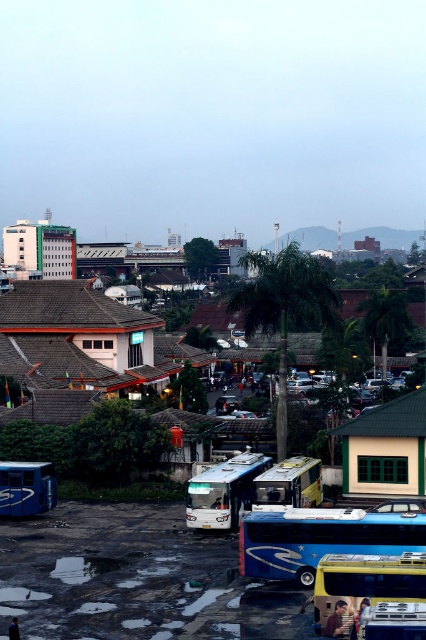
Based on the photo, you are standing on the rooftop where the image was taken. You see the beige matte building at center and the white matte bus at center. Which object is higher in elevation from your viewpoint?

The beige matte building at center is above the white matte bus at center, so the beige matte building at center is higher in elevation from your viewpoint.

Consider the image. You are standing at the rooftop overlooking the parking lot and buildings. You see two points marked as point 1 at coordinates point (423, 465) and point 2 at coordinates point (236, 483). Which point is closer to your current position?

Point 1 at coordinates point (423, 465) is closer to your current position because it is further to the camera than point 2 at coordinates point (236, 483).

You are standing at the center of the parking lot and want to locate the blue metallic bus at lower center. According to the coordinate system where the bottom left corner is the origin, can you tell me its position?

The blue metallic bus at lower center is located at point coordinates of (321, 538).